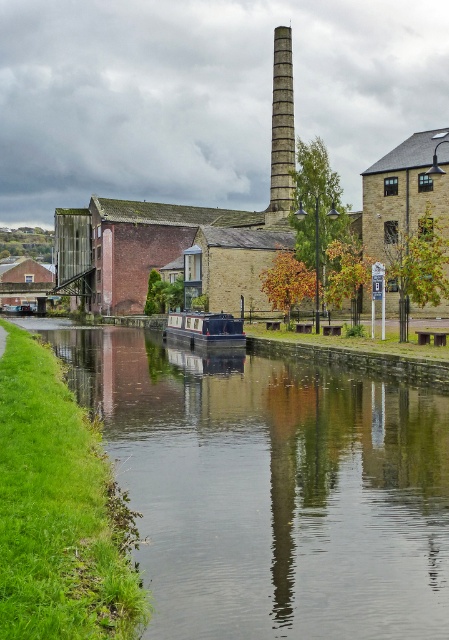
Question: Which object is positioned farthest from the polished dark blue boat at center?

Choices:
 (A) stone chimney at center
 (B) smooth concrete canal at center

Answer: (A)

Question: Among these points, which one is farthest from the camera?

Choices:
 (A) (230, 480)
 (B) (271, 179)

Answer: (B)

Question: Does smooth concrete canal at center have a larger size compared to polished dark blue boat at center?

Choices:
 (A) yes
 (B) no

Answer: (A)

Question: Is smooth concrete canal at center closer to camera compared to polished dark blue boat at center?

Choices:
 (A) no
 (B) yes

Answer: (B)

Question: Which object appears farthest from the camera in this image?

Choices:
 (A) polished dark blue boat at center
 (B) smooth concrete canal at center

Answer: (A)

Question: Does stone chimney at center have a smaller size compared to polished dark blue boat at center?

Choices:
 (A) no
 (B) yes

Answer: (A)